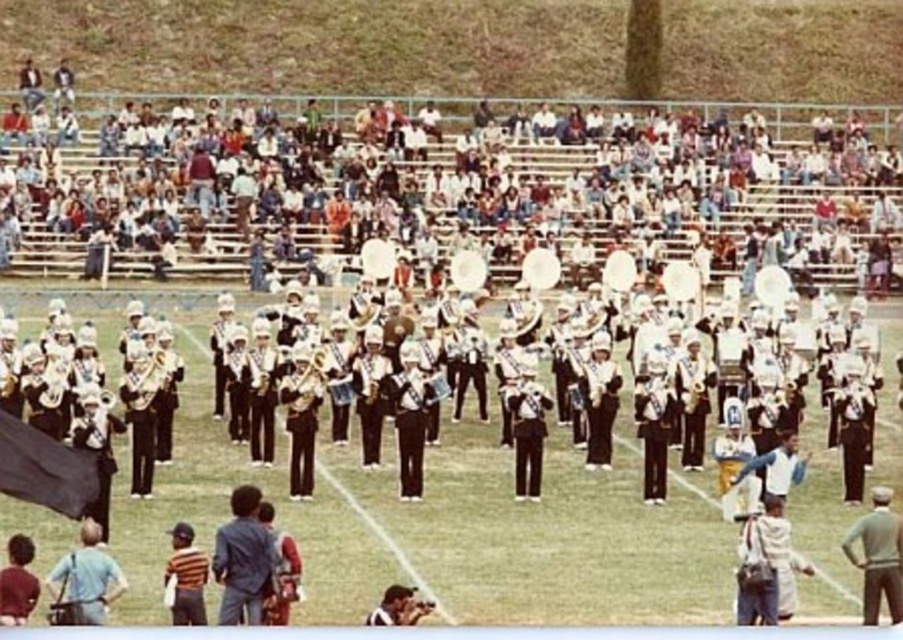
Does matte silver trumpet at center have a greater width compared to light brown leather jacket at lower center?

No.

Is matte silver trumpet at center behind light brown leather jacket at lower center?

Yes.

Image resolution: width=903 pixels, height=640 pixels. What do you see at coordinates (143, 385) in the screenshot?
I see `matte silver trumpet at center` at bounding box center [143, 385].

Where is `matte silver trumpet at center`? The image size is (903, 640). matte silver trumpet at center is located at coordinates (143, 385).

Who is more distant from viewer, [878,508] or [405,596]?

The point [878,508] is more distant.

Can you confirm if gray sweater at lower right is positioned below light brown leather jacket at lower center?

Actually, gray sweater at lower right is above light brown leather jacket at lower center.

You are a GUI agent. You are given a task and a screenshot of the screen. Output one action in this format:
    pyautogui.click(x=<x>, y=<y>)
    Task: Click on the gray sweater at lower right
    The height and width of the screenshot is (640, 903).
    Given the screenshot: What is the action you would take?
    (878, 556)

From the picture: Who is more forward, (268, 552) or (175, 538)?

Point (268, 552) is in front.

Can you confirm if blue fabric jacket at lower center is taller than striped shirt at lower left?

No, blue fabric jacket at lower center is not taller than striped shirt at lower left.

Who is more distant from viewer, (219, 557) or (182, 600)?

Positioned behind is point (219, 557).

Identify the location of blue fabric jacket at lower center. (243, 560).